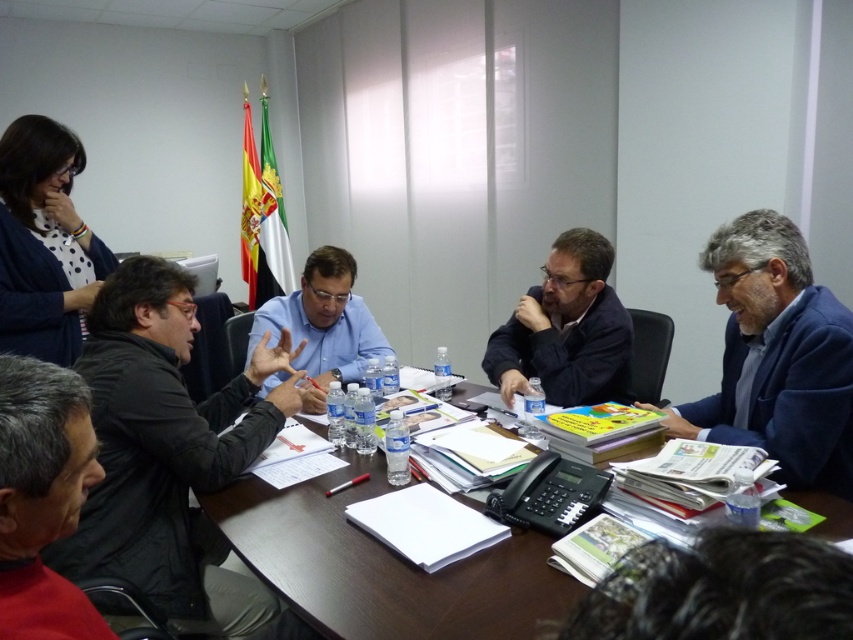
Looking at this image, is the position of black matte jacket at center more distant than that of blue shirt at center?

No, black matte jacket at center is closer to the viewer.

Does black matte jacket at center have a lesser height compared to blue shirt at center?

No, black matte jacket at center is not shorter than blue shirt at center.

The image size is (853, 640). What do you see at coordinates (169, 451) in the screenshot?
I see `black matte jacket at center` at bounding box center [169, 451].

Identify the location of black matte jacket at center. The width and height of the screenshot is (853, 640). (169, 451).

Is point (67, 406) positioned behind point (361, 365)?

No, (67, 406) is closer to viewer.

Who is more forward, (9, 579) or (289, 298)?

Point (9, 579)

Is point (32, 547) positioned behind point (334, 246)?

No, (32, 547) is closer to viewer.

Find the location of a particular element. This screenshot has height=640, width=853. red knitwear at lower left is located at coordinates (42, 497).

Is point (830, 532) closer to camera compared to point (694, 419)?

Yes, point (830, 532) is closer to viewer.

Which of these two, wooden table at center or blue fabric suit at right, stands shorter?

wooden table at center

Image resolution: width=853 pixels, height=640 pixels. Identify the location of wooden table at center. (381, 566).

Where is `wooden table at center`? Image resolution: width=853 pixels, height=640 pixels. wooden table at center is located at coordinates (381, 566).